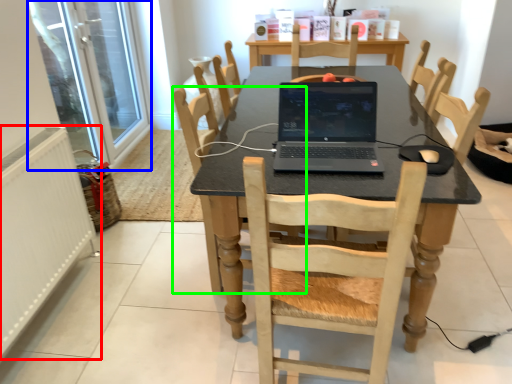
Question: Which object is positioned closest to radiator (highlighted by a red box)? Select from screen door (highlighted by a blue box) and chair (highlighted by a green box).

Choices:
 (A) screen door
 (B) chair

Answer: (B)